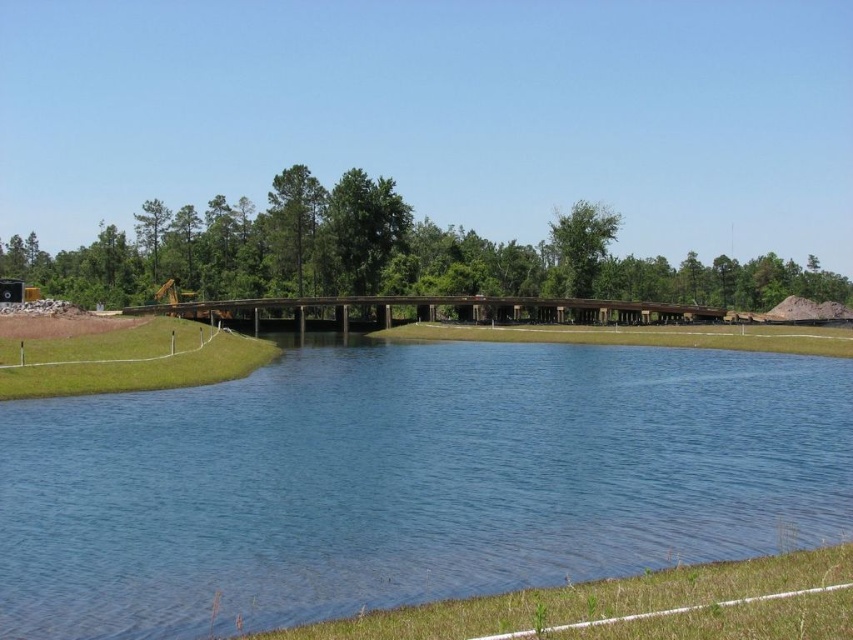
Does blue water at center appear under green grass at lower right?

Actually, blue water at center is above green grass at lower right.

Is point (486, 512) farther from viewer compared to point (445, 632)?

Yes, point (486, 512) is farther from viewer.

The image size is (853, 640). In order to click on blue water at center in this screenshot , I will do `click(408, 481)`.